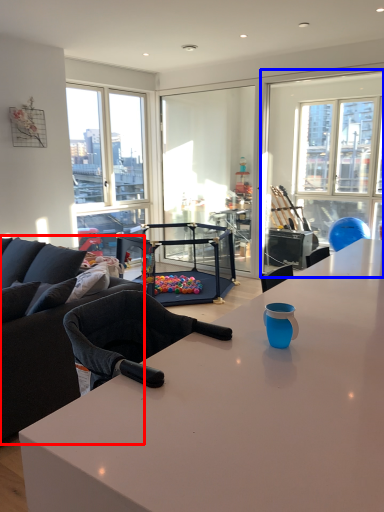
Question: Among these objects, which one is nearest to the camera, studio couch (highlighted by a red box) or window screen (highlighted by a blue box)?

Choices:
 (A) studio couch
 (B) window screen

Answer: (A)